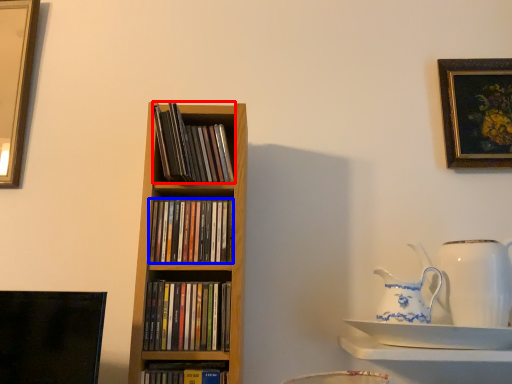
Question: Which object is further to the camera taking this photo, book (highlighted by a red box) or book (highlighted by a blue box)?

Choices:
 (A) book
 (B) book

Answer: (A)